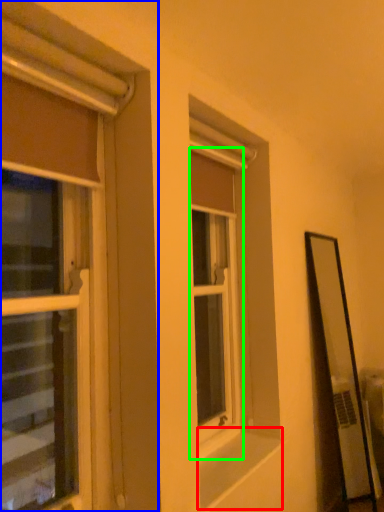
Question: Which object is the closest to the window sill (highlighted by a red box)? Choose among these: window (highlighted by a blue box) or window (highlighted by a green box).

Choices:
 (A) window
 (B) window

Answer: (B)